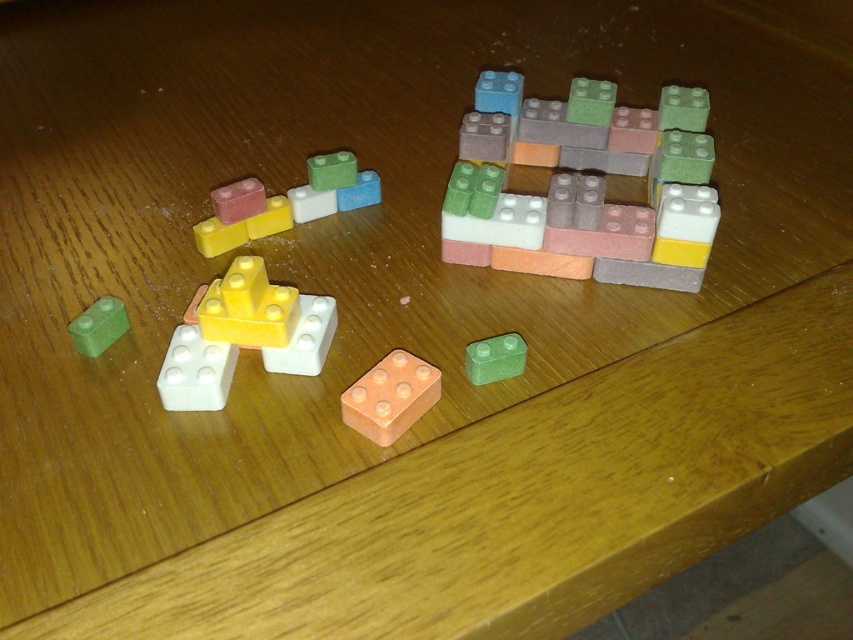
Question: Which object is positioned closest to the matte green plastic brick at lower left?

Choices:
 (A) pastel plastic blocks at upper left
 (B) white matte block at center
 (C) green matte brick at center

Answer: (B)

Question: Which point is closer to the camera?

Choices:
 (A) (515, 198)
 (B) (225, 321)

Answer: (B)

Question: Is white matte block at center-left further to camera compared to white matte block at center?

Choices:
 (A) yes
 (B) no

Answer: (B)

Question: Which of the following is the farthest from the observer?

Choices:
 (A) pastel rubber blocks at center
 (B) matte green plastic brick at lower left
 (C) pastel plastic blocks at upper left
 (D) white matte block at center

Answer: (C)

Question: Is the position of white matte block at center-left less distant than that of matte green plastic brick at lower left?

Choices:
 (A) yes
 (B) no

Answer: (A)

Question: Is pastel plastic blocks at upper left positioned at the back of matte yellow brick at center?

Choices:
 (A) no
 (B) yes

Answer: (B)